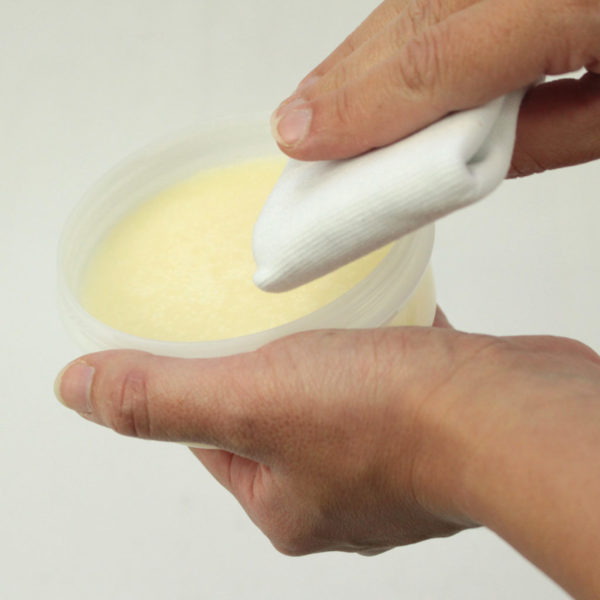
At what (x,y) coordinates should I click in order to perform the action: click on plastic cup. Please return your answer as a coordinate pair (x, y). Image resolution: width=600 pixels, height=600 pixels. Looking at the image, I should click on 104,193.